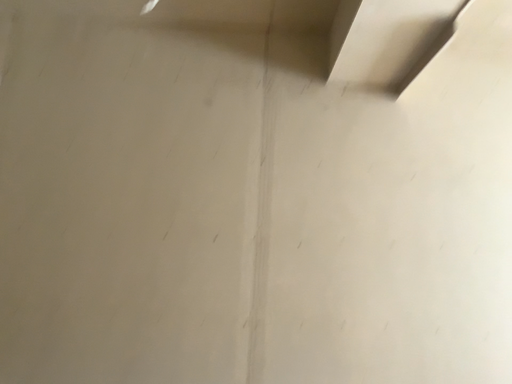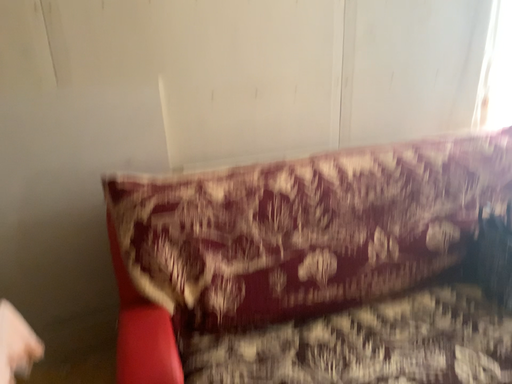
Question: How did the camera likely rotate when shooting the video?

Choices:
 (A) rotated right
 (B) rotated left

Answer: (A)